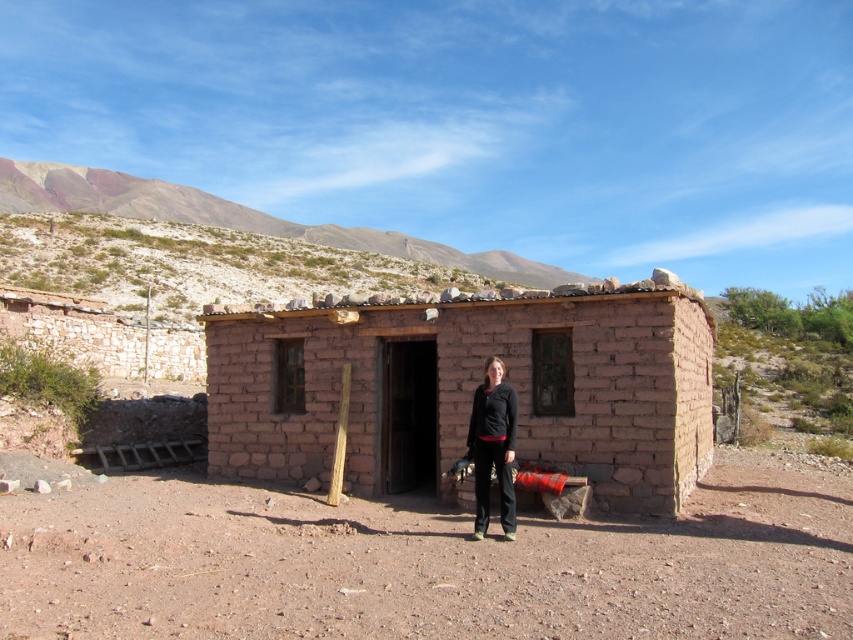
You are standing outside the earthy adobe hut at center and want to place a small potted plant on the ground. If you want the plant to be visible from the entrance, should you place it above or below the black matte pants at center?

The earthy adobe hut at center is above the black matte pants at center, so placing the potted plant below the black matte pants at center would keep it visible from the entrance.

You are standing at the coordinates 0.5, 0.5 in the image. You want to move towards the earthy adobe hut at center. In which direction should you move?

The earthy adobe hut at center is located at point [469,388]. Since your current position is at [426,320], you should move northeast to reach it.